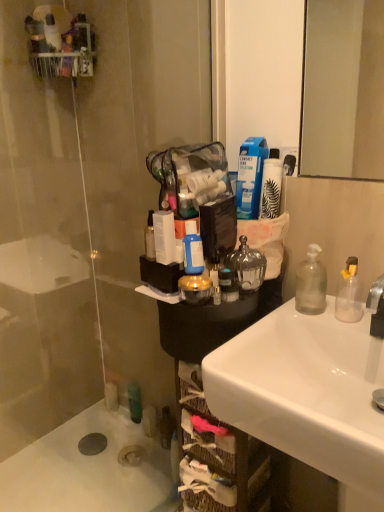
Question: From a real-world perspective, is blue matte bottle at center, the 1th bottle viewed from the left, above or below white matte bottle at upper right, which is counted as the 1th toiletry, starting from the top?

Choices:
 (A) above
 (B) below

Answer: (B)

Question: In the image, is blue matte bottle at center, which is counted as the second bottle, starting from the right, positioned in front of or behind white matte bottle at upper right, the 2th toiletry ordered from the bottom?

Choices:
 (A) front
 (B) behind

Answer: (A)

Question: Estimate the real-world distances between objects in this image. Which object is closer to the white matte bath at lower left?

Choices:
 (A) blue plastic bottle at upper center
 (B) transparent glass door at left
 (C) woven brown basket at lower center
 (D) transparent glass soap dispenser at right, the second bottle from the left
 (E) blue matte bottle at center, the 1th bottle viewed from the left

Answer: (B)

Question: Considering the real-world distances, which object is farthest from the white glossy sink at lower right?

Choices:
 (A) transparent glass soap dispenser at right, arranged as the first bottle when viewed from the right
 (B) transparent glass door at left
 (C) clear glass jar at center, which is counted as the second toiletry, starting from the top
 (D) woven brown basket at lower center
 (E) white matte bottle at upper right, which is counted as the 1th toiletry, starting from the top

Answer: (B)